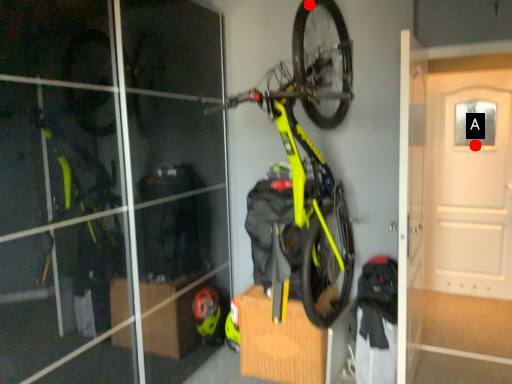
Question: Two points are circled on the image, labeled by A and B beside each circle. Among these points, which one is nearest to the camera?

Choices:
 (A) A is closer
 (B) B is closer

Answer: (B)